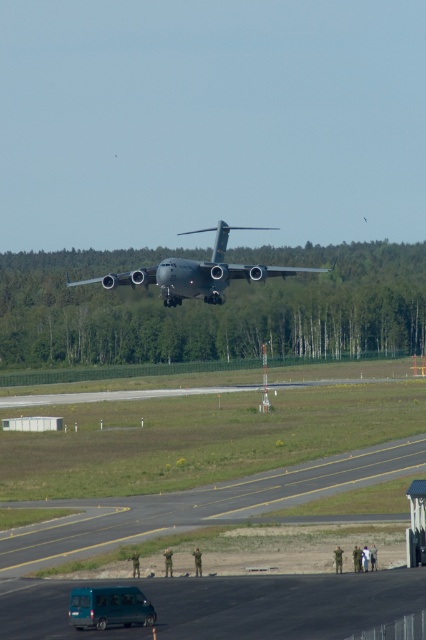
You are a pilot in a control tower and you need to guide a metallic gray aircraft at center to land on the runway. Based on its current position coordinates, which direction should the aircraft turn to align with the runway?

The metallic gray aircraft at center is positioned at coordinates point [198,273]. To align with the runway, it should turn to the right to head towards the right side of the frame as indicated by its current trajectory.

You are a pilot in the cockpit of the metallic gray aircraft at center. You need to land on the asphalt runway at lower center. Is the runway directly ahead of you, or behind you?

The asphalt runway at lower center is in front of the metallic gray aircraft at center, so the runway is directly ahead of you.